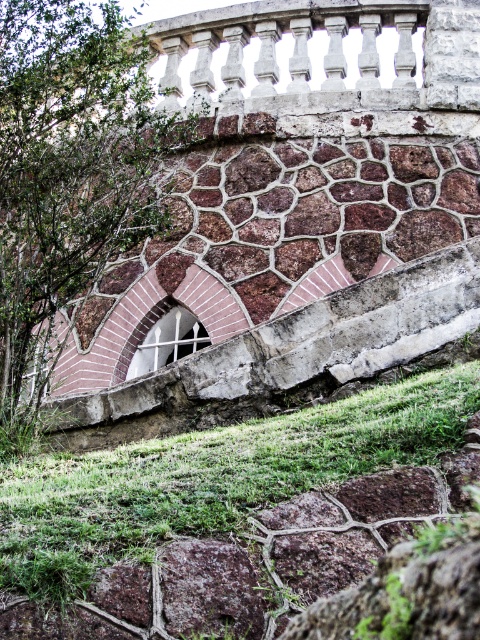
You are a landscape architect designing a garden. You need to place a 20 meter long decorative fence between the green grass at lower center and the white glass window at center. Is there enough space to fit the fence without it overlapping either the grass or the window?

The distance between the green grass at lower center and the white glass window at center is 21.19 meters. Since the fence is 20 meters long, there is sufficient space to place it between them without overlapping either the grass or the window.

Looking at this image, you are standing in front of the stone structure and want to determine which object is taller between the green grass at lower center and the white glass window at center. Based on the scene description, which one is taller?

The green grass at lower center is taller than the white glass window at center according to the description.